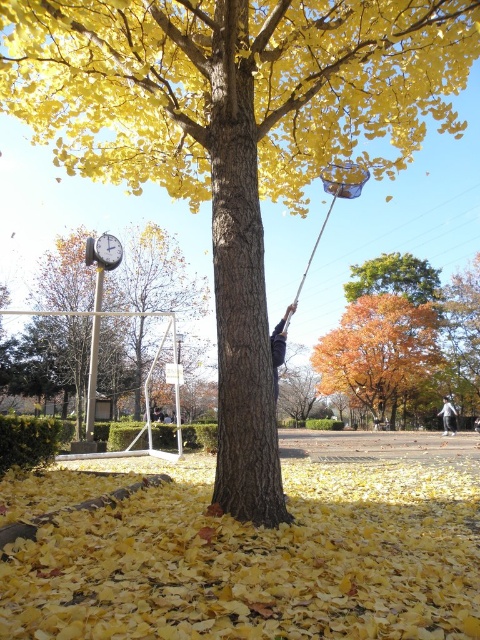
You are standing in the park and want to see the metallic gray clock at upper left clearly. However, the orange autumn leaves at center are blocking your view. How can you adjust your position to see the clock?

The metallic gray clock at upper left is behind the orange autumn leaves at center. To see the clock clearly, you should move to a position where you can look around or over the orange autumn leaves at center, which are in front of the clock.

You are standing in the park and notice two items in the scene. One is the metallic gray clock at upper left and the other is the dark gray fabric at tree trunk. Which of these two items is taller?

The metallic gray clock at upper left is taller than the dark gray fabric at tree trunk.